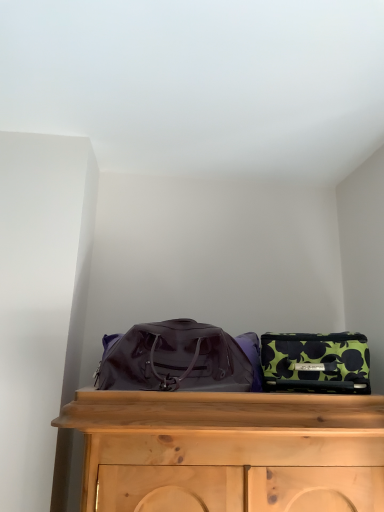
Question: From the image's perspective, is glossy purple duffel bag at center, the 2th luggage and bags when ordered from right to left, over green floral fabric bag at right, acting as the first luggage and bags starting from the right?

Choices:
 (A) yes
 (B) no

Answer: (A)

Question: Is glossy purple duffel bag at center, the 2th luggage and bags when ordered from right to left, thinner than green floral fabric bag at right, marked as the second luggage and bags in a left-to-right arrangement?

Choices:
 (A) yes
 (B) no

Answer: (B)

Question: Is glossy purple duffel bag at center, which is the first luggage and bags in left-to-right order, smaller than green floral fabric bag at right, marked as the second luggage and bags in a left-to-right arrangement?

Choices:
 (A) no
 (B) yes

Answer: (A)

Question: Is glossy purple duffel bag at center, the 2th luggage and bags when ordered from right to left, taller than green floral fabric bag at right, acting as the first luggage and bags starting from the right?

Choices:
 (A) no
 (B) yes

Answer: (B)

Question: Does glossy purple duffel bag at center, the 2th luggage and bags when ordered from right to left, have a greater width compared to green floral fabric bag at right, acting as the first luggage and bags starting from the right?

Choices:
 (A) yes
 (B) no

Answer: (A)

Question: Is green floral fabric bag at right, marked as the second luggage and bags in a left-to-right arrangement, located within glossy purple duffel bag at center, the 2th luggage and bags when ordered from right to left?

Choices:
 (A) no
 (B) yes

Answer: (A)

Question: From a real-world perspective, is green floral fabric bag at right, marked as the second luggage and bags in a left-to-right arrangement, positioned under glossy purple duffel bag at center, which is the first luggage and bags in left-to-right order, based on gravity?

Choices:
 (A) yes
 (B) no

Answer: (A)

Question: Does green floral fabric bag at right, acting as the first luggage and bags starting from the right, have a lesser width compared to glossy purple duffel bag at center, which is the first luggage and bags in left-to-right order?

Choices:
 (A) yes
 (B) no

Answer: (A)

Question: Can you confirm if green floral fabric bag at right, marked as the second luggage and bags in a left-to-right arrangement, is positioned to the right of glossy purple duffel bag at center, which is the first luggage and bags in left-to-right order?

Choices:
 (A) no
 (B) yes

Answer: (B)

Question: Is glossy purple duffel bag at center, the 2th luggage and bags when ordered from right to left, surrounded by green floral fabric bag at right, acting as the first luggage and bags starting from the right?

Choices:
 (A) no
 (B) yes

Answer: (A)

Question: Can you confirm if green floral fabric bag at right, acting as the first luggage and bags starting from the right, is smaller than glossy purple duffel bag at center, which is the first luggage and bags in left-to-right order?

Choices:
 (A) no
 (B) yes

Answer: (B)

Question: From the image's perspective, is green floral fabric bag at right, marked as the second luggage and bags in a left-to-right arrangement, under glossy purple duffel bag at center, which is the first luggage and bags in left-to-right order?

Choices:
 (A) yes
 (B) no

Answer: (A)

Question: From a real-world perspective, is green floral fabric bag at right, acting as the first luggage and bags starting from the right, above or below glossy purple duffel bag at center, the 2th luggage and bags when ordered from right to left?

Choices:
 (A) above
 (B) below

Answer: (B)